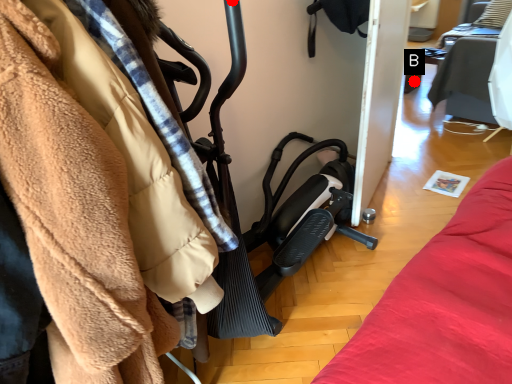
Question: Two points are circled on the image, labeled by A and B beside each circle. Which point is closer to the camera taking this photo?

Choices:
 (A) A is closer
 (B) B is closer

Answer: (A)